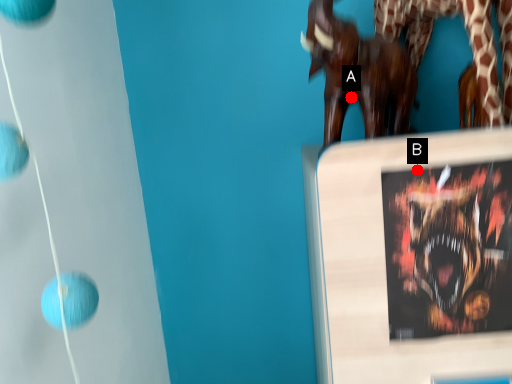
Question: Two points are circled on the image, labeled by A and B beside each circle. Which point is closer to the camera?

Choices:
 (A) A is closer
 (B) B is closer

Answer: (B)